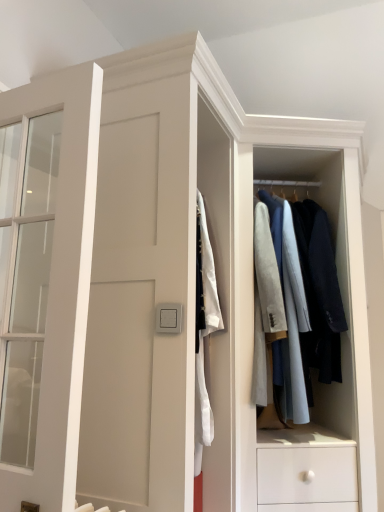
Question: Is satin silver switch at center at the back of matte white door at left?

Choices:
 (A) yes
 (B) no

Answer: (A)

Question: Is matte white door at left shorter than satin silver switch at center?

Choices:
 (A) yes
 (B) no

Answer: (B)

Question: Is matte white door at left bigger than satin silver switch at center?

Choices:
 (A) yes
 (B) no

Answer: (A)

Question: Is matte white door at left with satin silver switch at center?

Choices:
 (A) no
 (B) yes

Answer: (A)

Question: From a real-world perspective, is matte white door at left physically above satin silver switch at center?

Choices:
 (A) yes
 (B) no

Answer: (A)

Question: Is light gray fabric coat rack at center wider or thinner than satin silver switch at center?

Choices:
 (A) wide
 (B) thin

Answer: (A)

Question: Is light gray fabric coat rack at center taller or shorter than satin silver switch at center?

Choices:
 (A) short
 (B) tall

Answer: (B)

Question: Based on their positions, is light gray fabric coat rack at center located to the left or right of satin silver switch at center?

Choices:
 (A) left
 (B) right

Answer: (B)

Question: In the image, is light gray fabric coat rack at center positioned in front of or behind satin silver switch at center?

Choices:
 (A) behind
 (B) front

Answer: (A)

Question: Is point (74, 371) closer or farther from the camera than point (350, 342)?

Choices:
 (A) farther
 (B) closer

Answer: (B)

Question: From a real-world perspective, is matte white door at left physically located above or below light gray fabric coat rack at center?

Choices:
 (A) below
 (B) above

Answer: (A)

Question: Considering the relative positions of matte white door at left and light gray fabric coat rack at center in the image provided, is matte white door at left to the left or to the right of light gray fabric coat rack at center?

Choices:
 (A) left
 (B) right

Answer: (A)

Question: From their relative heights in the image, would you say matte white door at left is taller or shorter than light gray fabric coat rack at center?

Choices:
 (A) tall
 (B) short

Answer: (B)

Question: Would you say satin silver switch at center is inside or outside light gray fabric coat rack at center?

Choices:
 (A) outside
 (B) inside

Answer: (A)

Question: Is satin silver switch at center in front of or behind light gray fabric coat rack at center in the image?

Choices:
 (A) behind
 (B) front

Answer: (B)